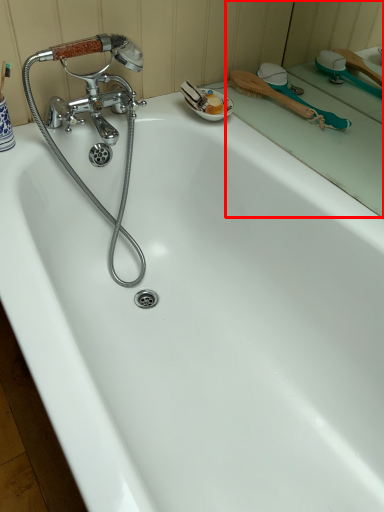
Question: From the image's perspective, where is mirror (annotated by the red box) located in relation to shower in the image?

Choices:
 (A) above
 (B) below

Answer: (B)